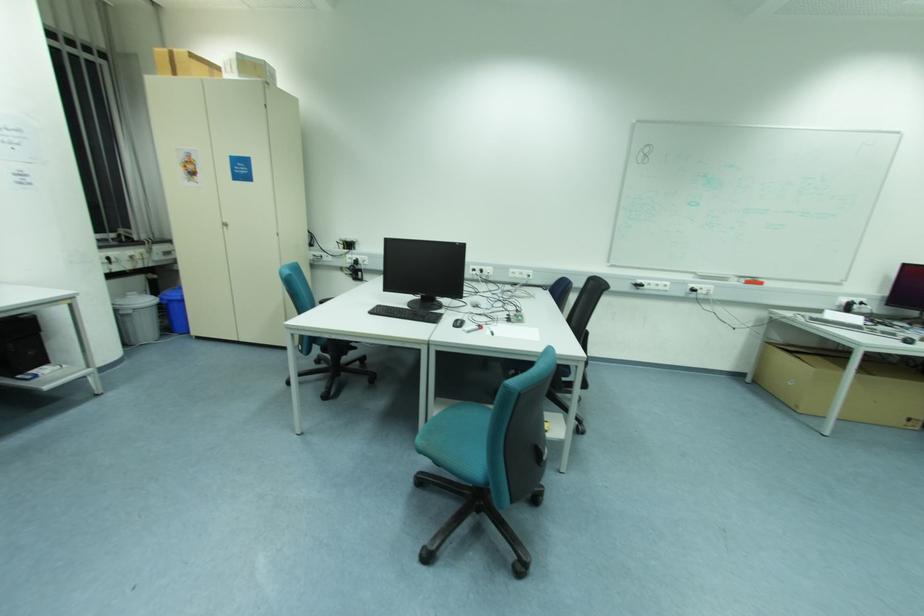
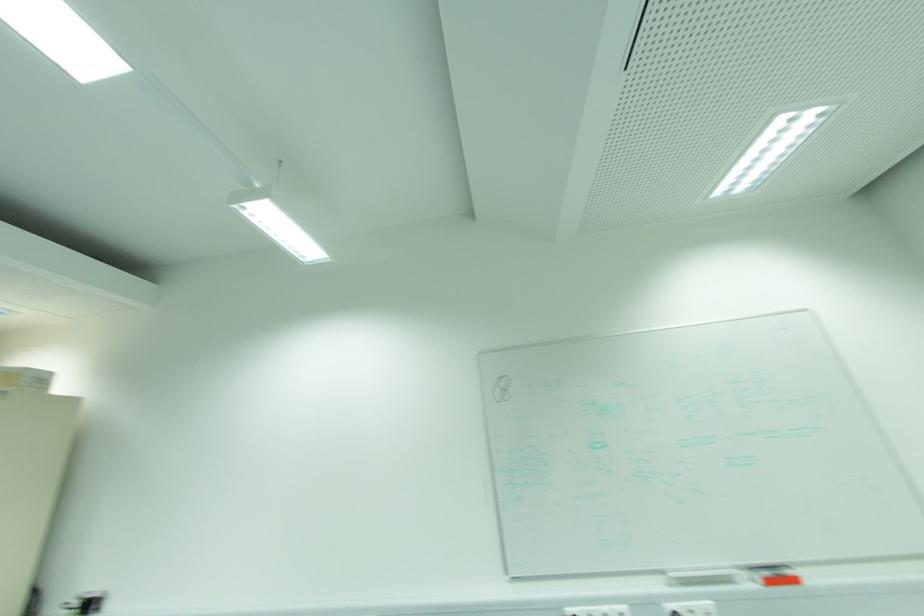
The point at (761, 284) is marked in the first image. Where is the corresponding point in the second image?

(796, 581)